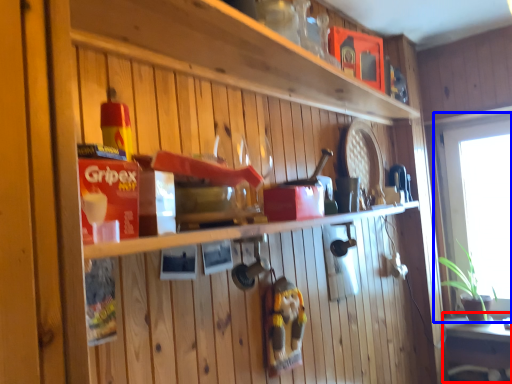
Question: Which object appears closest to the camera in this image, table (highlighted by a red box) or window (highlighted by a blue box)?

Choices:
 (A) table
 (B) window

Answer: (A)